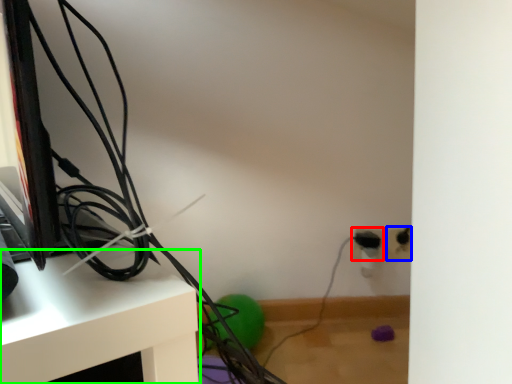
Question: Which is nearer to the electric outlet (highlighted by a red box)? electric outlet (highlighted by a blue box) or furniture (highlighted by a green box).

Choices:
 (A) electric outlet
 (B) furniture

Answer: (A)